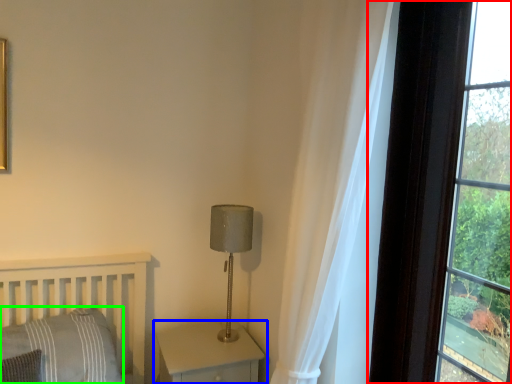
Question: Which is farther away from window (highlighted by a red box)? nightstand (highlighted by a blue box) or pillow (highlighted by a green box)?

Choices:
 (A) nightstand
 (B) pillow

Answer: (B)